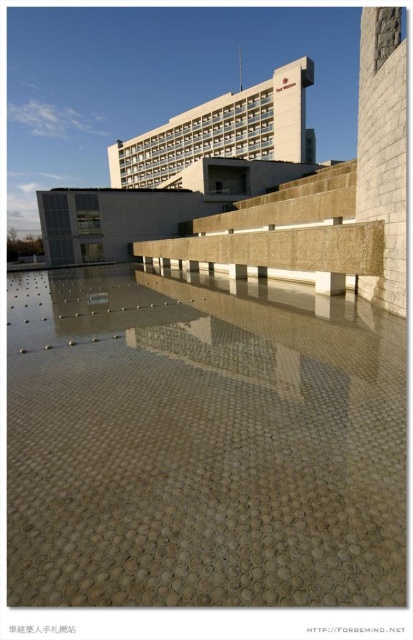
You are a visitor standing at the entrance of the building. You see the translucent glass mosaic at center and the beige stone plaza at upper center. Which object is closer to you?

The translucent glass mosaic at center is closer to you since it has a lesser height compared to the beige stone plaza at upper center, indicating it is positioned lower in the scene.

You are standing in the plaza and want to take a photo of the translucent glass mosaic at center. Since the beige stone plaza at upper center is in the way, which direction should you move to get a clear view?

You should move to the left to get a clear view of the translucent glass mosaic at center because it is positioned to the right of the beige stone plaza at upper center.